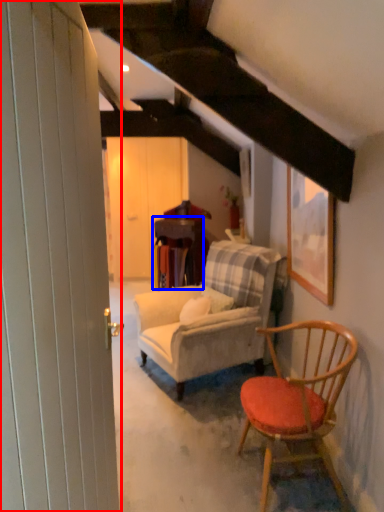
Question: Which object appears farthest to the camera in this image, barn door (highlighted by a red box) or table (highlighted by a blue box)?

Choices:
 (A) barn door
 (B) table

Answer: (B)